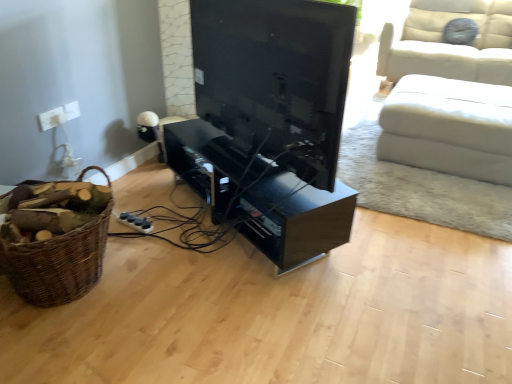
Question: Is matte black tv at center wider than white plastic socket at upper left?

Choices:
 (A) yes
 (B) no

Answer: (A)

Question: Are matte black tv at center and white plastic socket at upper left far apart?

Choices:
 (A) yes
 (B) no

Answer: (A)

Question: Is matte black tv at center shorter than white plastic socket at upper left?

Choices:
 (A) yes
 (B) no

Answer: (B)

Question: Would you say matte black tv at center contains white plastic socket at upper left?

Choices:
 (A) yes
 (B) no

Answer: (B)

Question: Is matte black tv at center at the left side of white plastic socket at upper left?

Choices:
 (A) no
 (B) yes

Answer: (A)

Question: Considering their positions, is brown woven basket at left located in front of or behind matte black tv at center?

Choices:
 (A) front
 (B) behind

Answer: (A)

Question: Would you say brown woven basket at left is inside or outside matte black tv at center?

Choices:
 (A) outside
 (B) inside

Answer: (A)

Question: Is brown woven basket at left wider or thinner than matte black tv at center?

Choices:
 (A) wide
 (B) thin

Answer: (A)

Question: From the image's perspective, relative to matte black tv at center, is brown woven basket at left above or below?

Choices:
 (A) below
 (B) above

Answer: (A)

Question: Looking at their shapes, would you say black glossy entertainment center at center is wider or thinner than white leather ottoman at right?

Choices:
 (A) wide
 (B) thin

Answer: (B)

Question: Considering the relative positions of black glossy entertainment center at center and white leather ottoman at right in the image provided, is black glossy entertainment center at center to the left or to the right of white leather ottoman at right?

Choices:
 (A) right
 (B) left

Answer: (B)

Question: From the image's perspective, is black glossy entertainment center at center above or below white leather ottoman at right?

Choices:
 (A) below
 (B) above

Answer: (A)

Question: Is black glossy entertainment center at center situated inside white leather ottoman at right or outside?

Choices:
 (A) inside
 (B) outside

Answer: (B)

Question: From a real-world perspective, relative to brown woven basket at left, is white leather ottoman at right vertically above or below?

Choices:
 (A) below
 (B) above

Answer: (B)

Question: Choose the correct answer: Is white leather ottoman at right inside brown woven basket at left or outside it?

Choices:
 (A) outside
 (B) inside

Answer: (A)